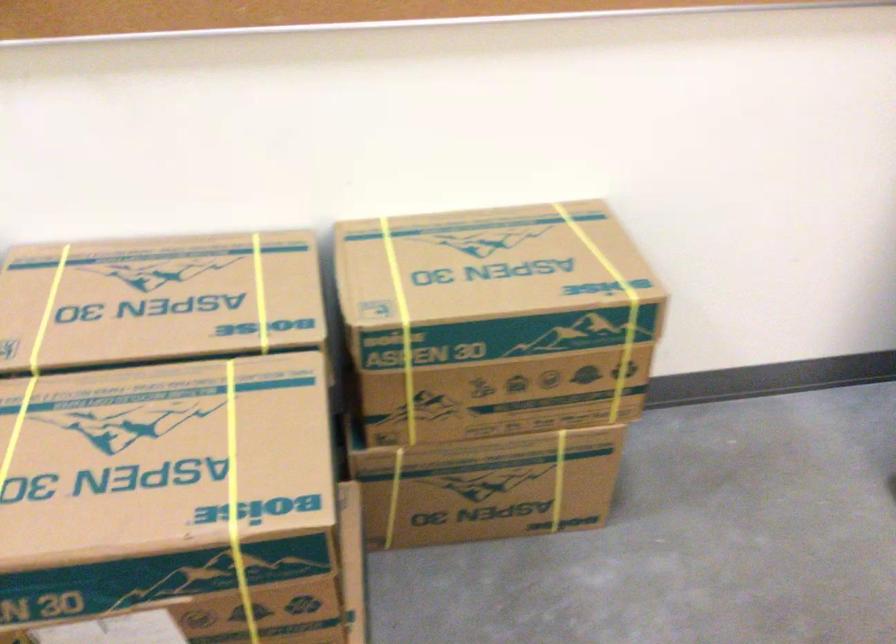
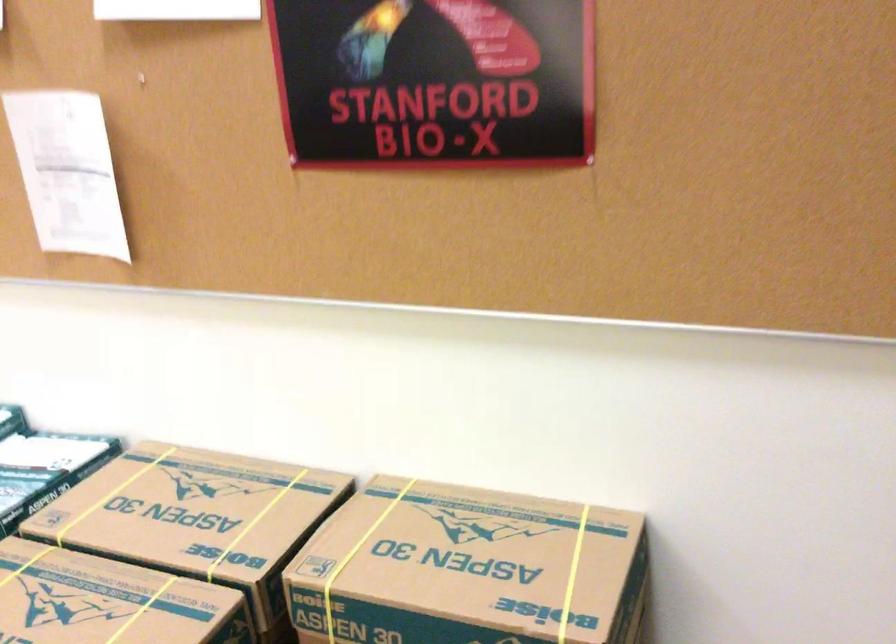
Where in the second image is the point corresponding to pixel 229 400 from the first image?

(142, 609)